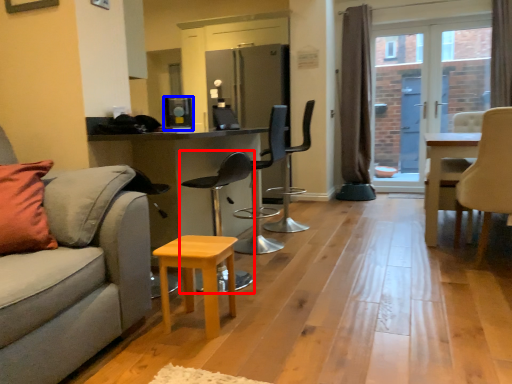
Question: Which object is closer to the camera taking this photo, chair (highlighted by a red box) or appliance (highlighted by a blue box)?

Choices:
 (A) chair
 (B) appliance

Answer: (A)